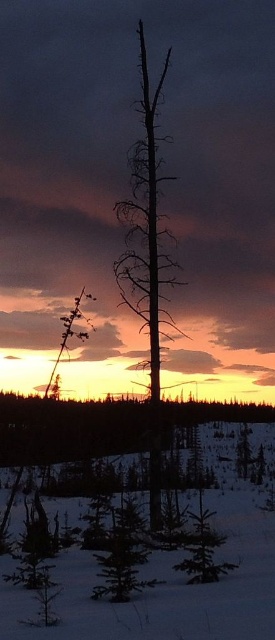
You are an artist sketching the winter landscape. You need to place the white fluffy snow at center and the silhouette bare tree at center in your drawing. According to the scene, which object should you draw first to ensure proper layering?

You should draw the silhouette bare tree at center first because the white fluffy snow at center is positioned on its left side, meaning the snow is in front of the tree and needs to be layered over it.

In the scene shown: You are an artist sketching this winter scene. You want to draw the silhouette bare tree at center and the green matte evergreen tree at center. Which tree should you draw first if you are following the rule of drawing foreground objects before background ones?

You should draw the silhouette bare tree at center first because it is closer to the viewer than the green matte evergreen tree at center, making it part of the foreground.